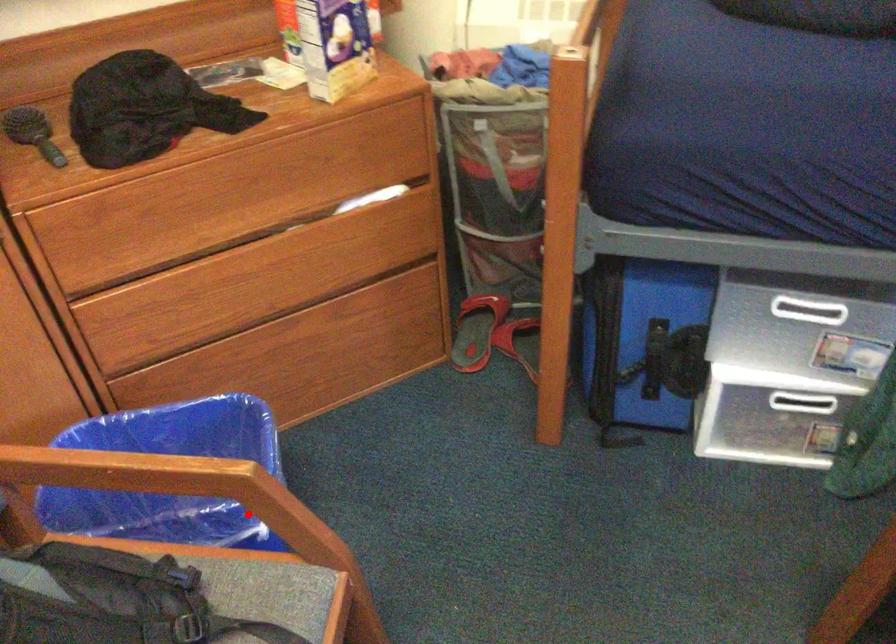
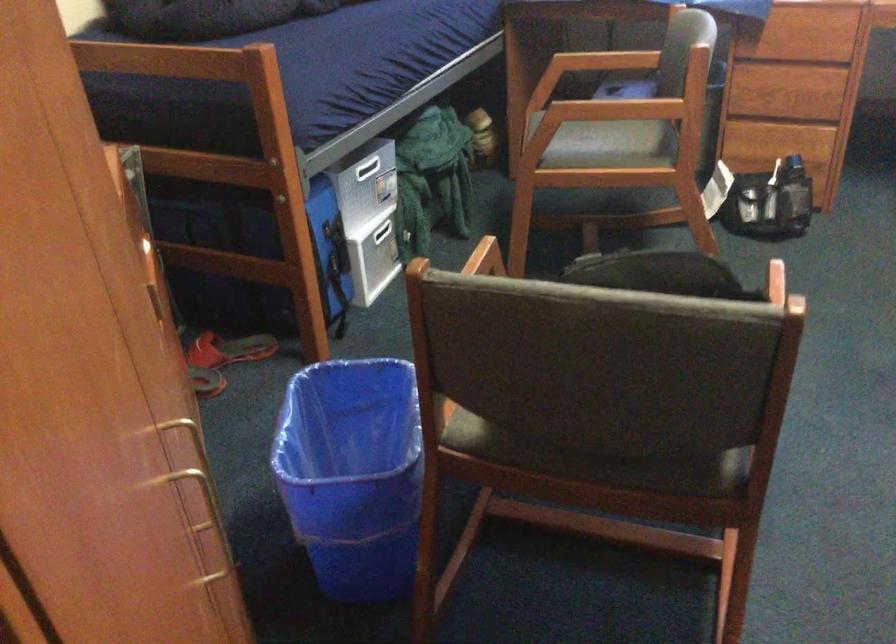
Find the pixel in the second image that matches the highlighted location in the first image.

(487, 257)